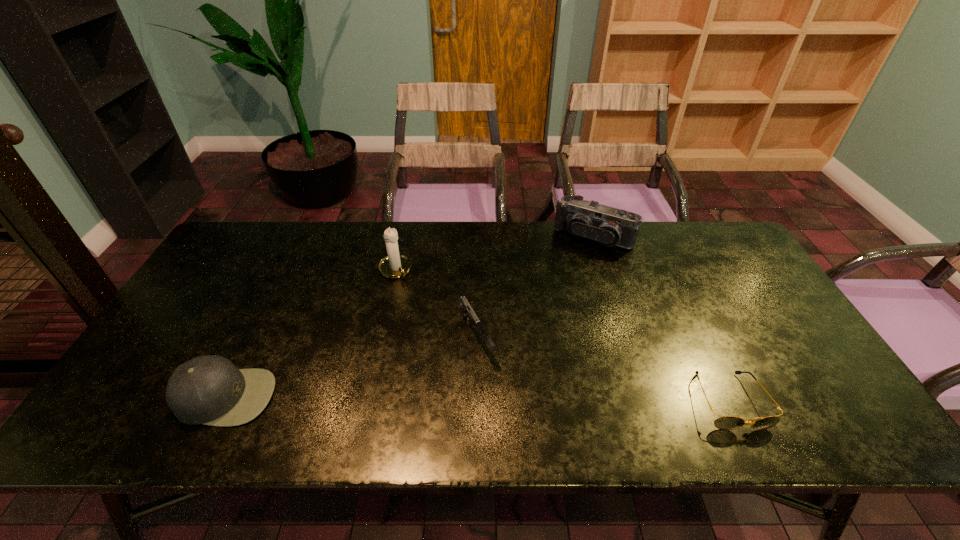
Where is `free space that satisfies the following two spatial constraints: 1. on the back side of the camcorder; 2. on the left side of the tallest object`? free space that satisfies the following two spatial constraints: 1. on the back side of the camcorder; 2. on the left side of the tallest object is located at coordinates (402, 237).